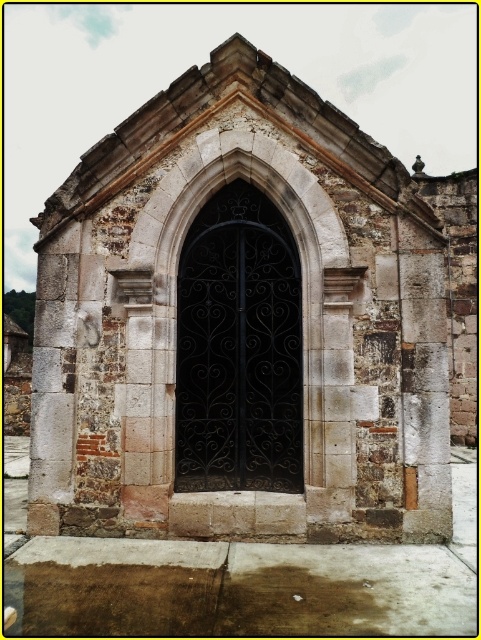
Is stone arched door at center positioned behind black wrought iron door at center?

No, it is in front of black wrought iron door at center.

Based on the photo, which of these two, stone arched door at center or black wrought iron door at center, stands shorter?

stone arched door at center

Based on the photo, who is more distant from viewer, (397, 390) or (197, 364)?

Positioned behind is point (197, 364).

Identify the location of stone arched door at center. (240, 324).